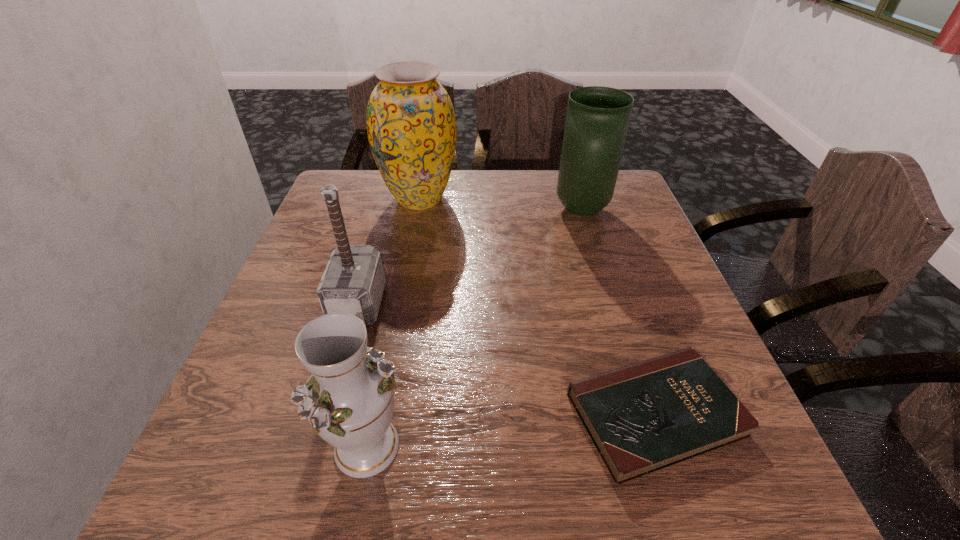
You are a GUI agent. You are given a task and a screenshot of the screen. Output one action in this format:
    pyautogui.click(x=<x>, y=<y>)
    Task: Click on the vacant space that satisfies the following two spatial constraints: 1. on the front side of the rightmost vase; 2. for striking with the head of the third farthest object
    This screenshot has height=540, width=960.
    Given the screenshot: What is the action you would take?
    pyautogui.click(x=611, y=303)

Locate an element on the screen. The image size is (960, 540). blank area in the image that satisfies the following two spatial constraints: 1. for striking with the head of the shortest object; 2. on the right side of the third farthest object is located at coordinates (327, 414).

I want to click on vacant position in the image that satisfies the following two spatial constraints: 1. on the back side of the shortest vase; 2. on the right side of the rightmost vase, so click(414, 210).

You are a GUI agent. You are given a task and a screenshot of the screen. Output one action in this format:
    pyautogui.click(x=<x>, y=<y>)
    Task: Click on the vacant area that satisfies the following two spatial constraints: 1. for striking with the head of the shortest object; 2. on the right side of the hammer
    
    Given the screenshot: What is the action you would take?
    pyautogui.click(x=327, y=414)

At what (x,y) coordinates should I click in order to perform the action: click on vacant position in the image that satisfies the following two spatial constraints: 1. for striking with the head of the Bible; 2. on the right side of the third nearest object. Please return your answer as a coordinate pair (x, y). This screenshot has height=540, width=960. Looking at the image, I should click on click(x=327, y=414).